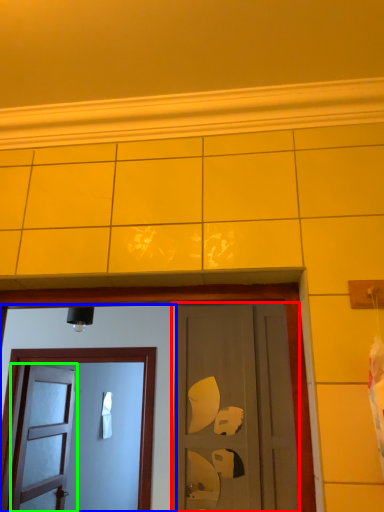
Question: Which object is the farthest from door (highlighted by a red box)? Choose among these: door (highlighted by a blue box) or door (highlighted by a green box).

Choices:
 (A) door
 (B) door

Answer: (B)